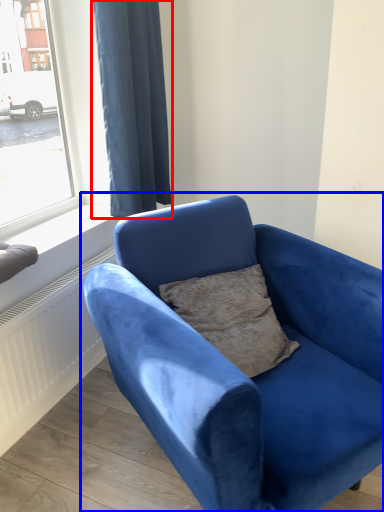
Question: Among these objects, which one is nearest to the camera, curtain (highlighted by a red box) or studio couch (highlighted by a blue box)?

Choices:
 (A) curtain
 (B) studio couch

Answer: (B)